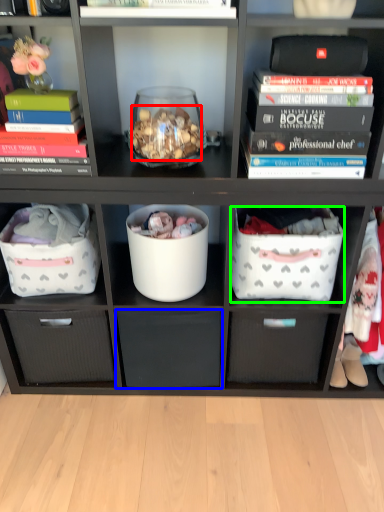
Question: Which object is positioned farthest from stuff (highlighted by a red box)? Select from drawer (highlighted by a blue box) and laundry basket (highlighted by a green box).

Choices:
 (A) drawer
 (B) laundry basket

Answer: (A)